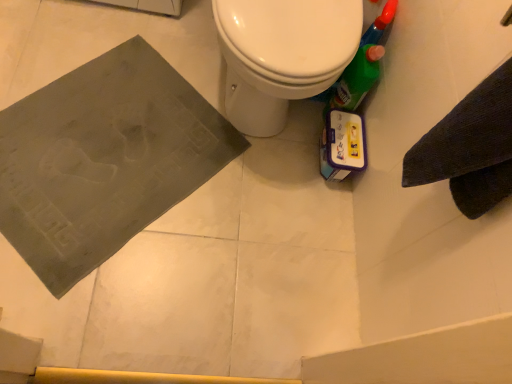
Where is `free space above dark gray rubber mat at lower left (from a real-world perspective)`? free space above dark gray rubber mat at lower left (from a real-world perspective) is located at coordinates (131, 137).